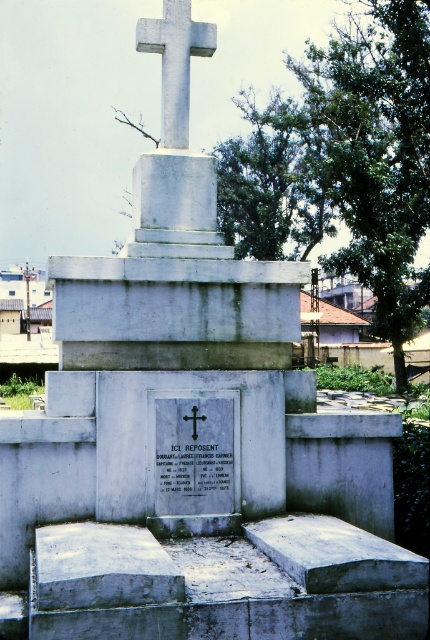
Can you confirm if white stone cross at upper center is taller than white stone cross at center?

Yes, white stone cross at upper center is taller than white stone cross at center.

Find the location of a particular element. white stone cross at upper center is located at coordinates (175, 61).

What do you see at coordinates (175, 61) in the screenshot? I see `white stone cross at upper center` at bounding box center [175, 61].

Identify the location of white stone cross at upper center. (175, 61).